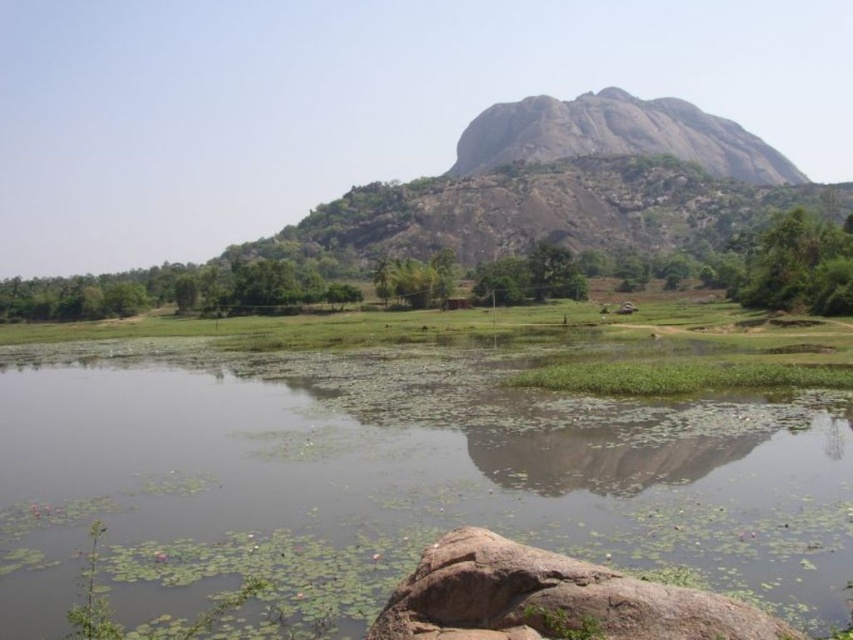
Question: Is green leafy tree at center smaller than granite rock at lower center?

Choices:
 (A) yes
 (B) no

Answer: (B)

Question: Which point is closer to the camera?

Choices:
 (A) (838, 237)
 (B) (526, 147)

Answer: (A)

Question: Where is green leafy water at center located in relation to green grassy field at center in the image?

Choices:
 (A) below
 (B) above

Answer: (A)

Question: Among these points, which one is nearest to the camera?

Choices:
 (A) (784, 241)
 (B) (764, 472)

Answer: (B)

Question: Does rough granite mountain at center lie in front of green leafy tree at right?

Choices:
 (A) no
 (B) yes

Answer: (A)

Question: Which point is farther to the camera?

Choices:
 (A) rough granite mountain at center
 (B) granite rock at lower center
 (C) green leafy tree at center
 (D) green leafy water at center

Answer: (A)